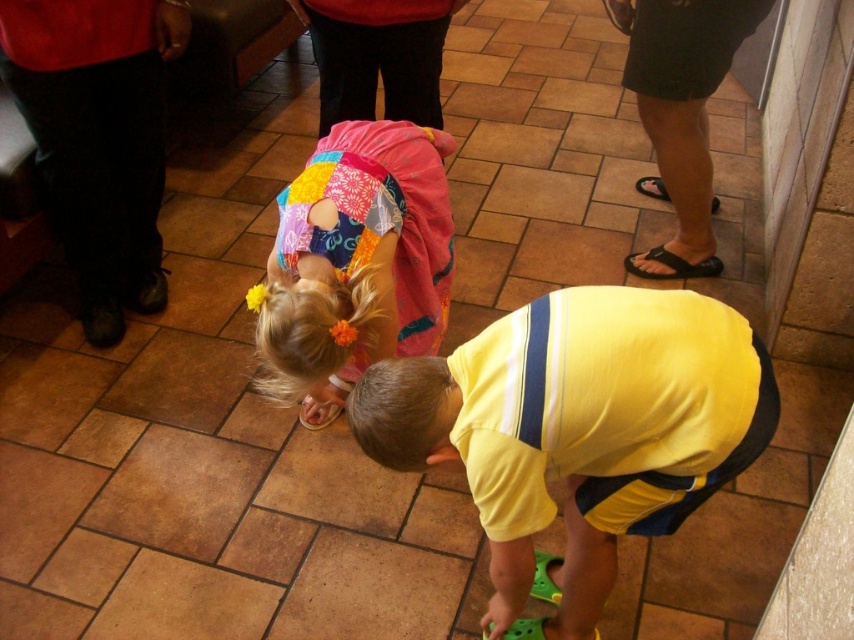
Question: Which object appears closest to the camera in this image?

Choices:
 (A) patchwork fabric dress at center
 (B) yellow cotton shirt at lower center

Answer: (B)

Question: Can you confirm if yellow cotton shirt at lower center is positioned above patchwork fabric dress at center?

Choices:
 (A) no
 (B) yes

Answer: (A)

Question: Can you confirm if yellow cotton shirt at lower center is smaller than patchwork fabric dress at center?

Choices:
 (A) no
 (B) yes

Answer: (B)

Question: Which of the following is the farthest from the observer?

Choices:
 (A) (654, 333)
 (B) (307, 224)

Answer: (B)

Question: Can you confirm if yellow cotton shirt at lower center is positioned to the right of patchwork fabric dress at center?

Choices:
 (A) no
 (B) yes

Answer: (B)